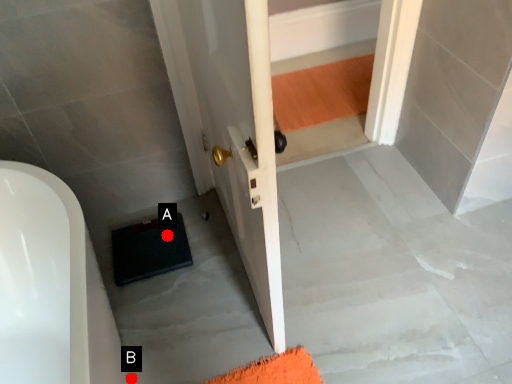
Question: Two points are circled on the image, labeled by A and B beside each circle. Which point is further to the camera?

Choices:
 (A) A is further
 (B) B is further

Answer: (A)